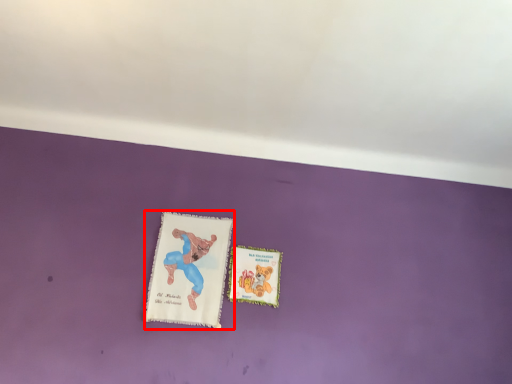
Question: From the image's perspective, considering the relative positions of paperback book (annotated by the red box) and paperback book in the image provided, where is paperback book (annotated by the red box) located with respect to the staircase?

Choices:
 (A) below
 (B) above

Answer: (B)